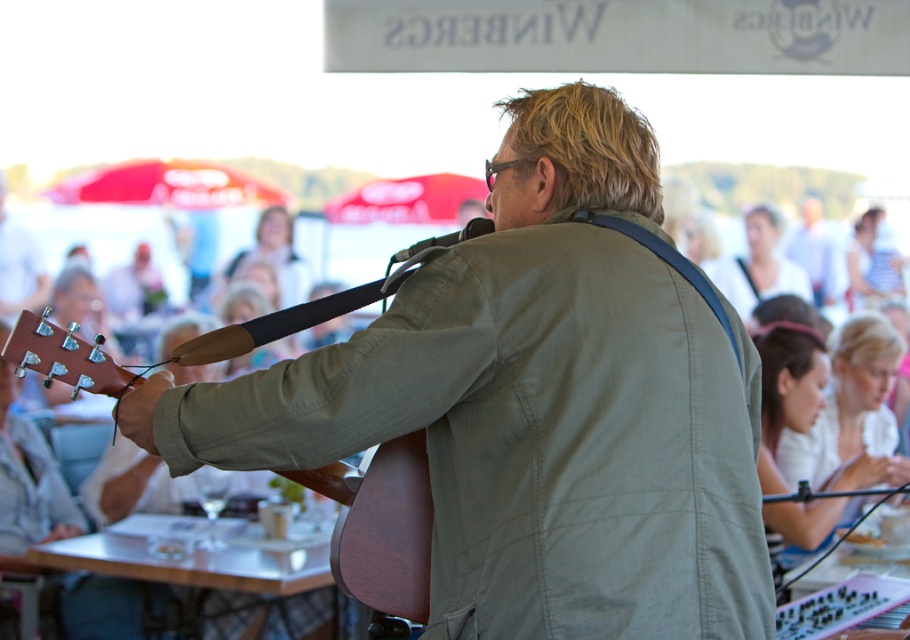
Question: Which point is closer to the camera taking this photo?

Choices:
 (A) (391, 442)
 (B) (708, 376)

Answer: (B)

Question: Considering the relative positions of matte brown guitar at center and wooden acoustic guitar at center in the image provided, where is matte brown guitar at center located with respect to wooden acoustic guitar at center?

Choices:
 (A) left
 (B) right

Answer: (B)

Question: Is matte brown guitar at center above wooden acoustic guitar at center?

Choices:
 (A) yes
 (B) no

Answer: (A)

Question: Which object is closer to the camera taking this photo?

Choices:
 (A) matte brown guitar at center
 (B) wooden acoustic guitar at center

Answer: (A)

Question: Considering the relative positions of matte brown guitar at center and wooden acoustic guitar at center in the image provided, where is matte brown guitar at center located with respect to wooden acoustic guitar at center?

Choices:
 (A) left
 (B) right

Answer: (B)